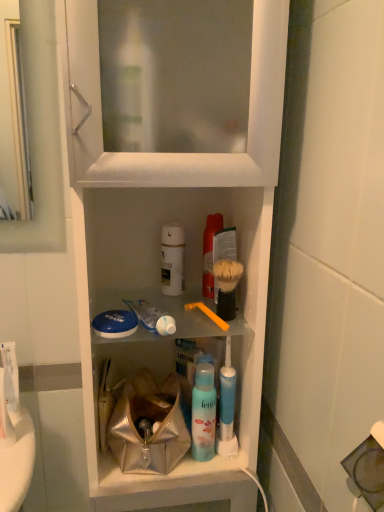
Question: From the image's perspective, is white glossy toothpaste at center positioned above or below blue matte mouthwash at center, marked as the 3th mouthwash in a top-to-bottom arrangement?

Choices:
 (A) below
 (B) above

Answer: (B)

Question: Would you say white glossy toothpaste at center is to the left or to the right of blue matte mouthwash at center, placed as the first mouthwash when sorted from bottom to top, in the picture?

Choices:
 (A) left
 (B) right

Answer: (A)

Question: Which object is positioned closest to the blue matte mouthwash at center, placed as the first mouthwash when sorted from bottom to top?

Choices:
 (A) translucent plastic mouthwash at center, the 1th mouthwash positioned from the top
 (B) orange plastic toothbrush at center
 (C) metallic silver bag at center
 (D) white glossy toothpaste at center
 (E) white plastic cabinet at center

Answer: (C)

Question: Which object is positioned farthest from the orange plastic toothbrush at center?

Choices:
 (A) translucent plastic mouthwash at center, the 1th mouthwash positioned from the top
 (B) white glossy toothpaste at center
 (C) bristled plastic shaving brush at center-right
 (D) white plastic cabinet at center
 (E) white matte bottle at center, which is the 2th mouthwash in bottom-to-top order

Answer: (D)